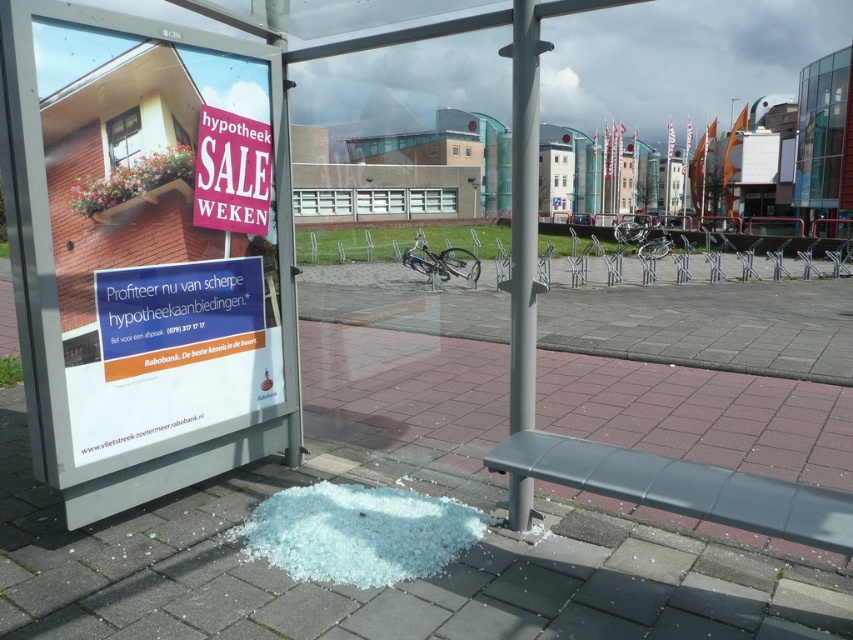
Question: Is white glossy poster at left bigger than matte pink sign at upper left?

Choices:
 (A) yes
 (B) no

Answer: (A)

Question: Which point is closer to the camera?

Choices:
 (A) (236, 458)
 (B) (521, 378)

Answer: (B)

Question: Does white glossy poster at left have a larger size compared to matte pink sign at upper left?

Choices:
 (A) no
 (B) yes

Answer: (B)

Question: Which of the following is the farthest from the observer?

Choices:
 (A) matte pink sign at upper left
 (B) white glossy poster at left
 (C) metallic gray pole at center

Answer: (A)

Question: Estimate the real-world distances between objects in this image. Which object is closer to the matte pink sign at upper left?

Choices:
 (A) white glossy poster at left
 (B) metallic gray pole at center

Answer: (A)

Question: Can you confirm if white glossy poster at left is positioned to the left of metallic gray pole at center?

Choices:
 (A) yes
 (B) no

Answer: (A)